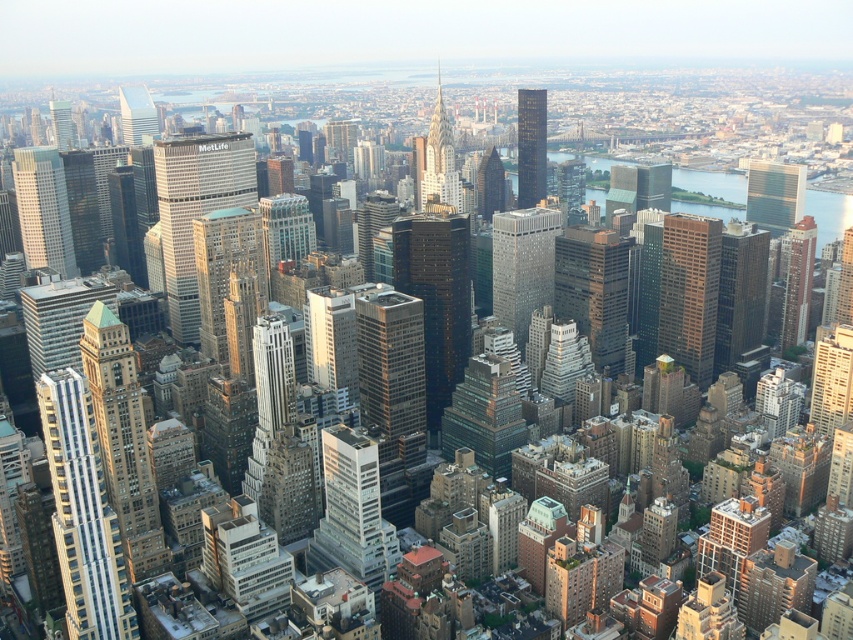
Who is more distant from viewer, (165, 202) or (792, 196)?

The point (792, 196) is more distant.

Is point (234, 170) positioned after point (769, 196)?

No, (234, 170) is in front of (769, 196).

Which is in front, point (178, 289) or point (759, 170)?

Point (178, 289) is in front.

Where is `matte glass skyscraper at center`? matte glass skyscraper at center is located at coordinates (196, 209).

Does sleek glass skyscraper at center appear under green glass skyscraper at center?

Indeed, sleek glass skyscraper at center is positioned under green glass skyscraper at center.

Is sleek glass skyscraper at center positioned in front of green glass skyscraper at center?

That is True.

Identify the location of sleek glass skyscraper at center. (392, 376).

Is silver glass skyscraper at center further to the viewer compared to matte glass skyscraper at center-left?

No.

Between point (252, 448) and point (57, 248), which one is positioned in front?

Point (252, 448) is more forward.

Find the location of a particular element. The width and height of the screenshot is (853, 640). silver glass skyscraper at center is located at coordinates (279, 440).